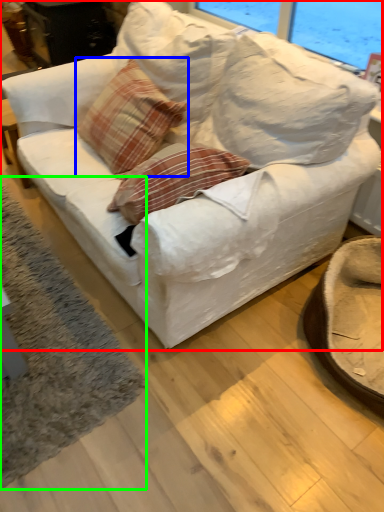
Question: Considering the real-world distances, which object is farthest from studio couch (highlighted by a red box)? throw pillow (highlighted by a blue box) or mat (highlighted by a green box)?

Choices:
 (A) throw pillow
 (B) mat

Answer: (B)